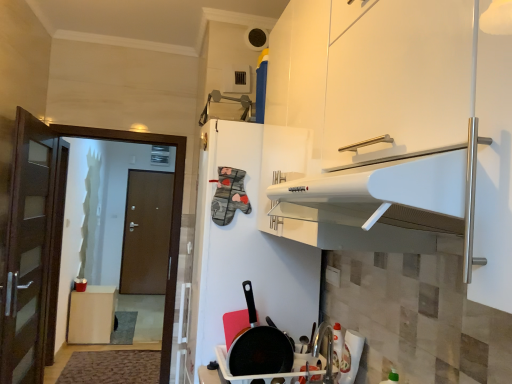
Question: Does brown wooden door at left have a larger size compared to brown wood trash can at left?

Choices:
 (A) no
 (B) yes

Answer: (B)

Question: Are brown wooden door at left and brown wood trash can at left located far from each other?

Choices:
 (A) no
 (B) yes

Answer: (B)

Question: Can you confirm if brown wooden door at left is thinner than brown wood trash can at left?

Choices:
 (A) no
 (B) yes

Answer: (B)

Question: Does brown wooden door at left contain brown wood trash can at left?

Choices:
 (A) no
 (B) yes

Answer: (A)

Question: From a real-world perspective, is brown wooden door at left positioned under brown wood trash can at left based on gravity?

Choices:
 (A) yes
 (B) no

Answer: (B)

Question: From a real-world perspective, is white matte refrigerator at center physically located above or below brown wood trash can at left?

Choices:
 (A) above
 (B) below

Answer: (A)

Question: Is white matte refrigerator at center bigger or smaller than brown wood trash can at left?

Choices:
 (A) small
 (B) big

Answer: (B)

Question: Is point (189, 367) closer or farther from the camera than point (106, 327)?

Choices:
 (A) closer
 (B) farther

Answer: (A)

Question: In the image, is white matte refrigerator at center positioned in front of or behind brown wood trash can at left?

Choices:
 (A) front
 (B) behind

Answer: (A)

Question: In the image, is brown matte door at left on the left side or the right side of brown wood trash can at left?

Choices:
 (A) right
 (B) left

Answer: (B)

Question: From the image's perspective, relative to brown wood trash can at left, is brown matte door at left above or below?

Choices:
 (A) above
 (B) below

Answer: (A)

Question: Is brown matte door at left wider or thinner than brown wood trash can at left?

Choices:
 (A) wide
 (B) thin

Answer: (B)

Question: Looking at the image, does brown matte door at left seem bigger or smaller compared to brown wood trash can at left?

Choices:
 (A) small
 (B) big

Answer: (B)

Question: Is white matte refrigerator at center taller or shorter than brown matte door at left?

Choices:
 (A) short
 (B) tall

Answer: (A)

Question: In the image, is white matte refrigerator at center on the left side or the right side of brown matte door at left?

Choices:
 (A) left
 (B) right

Answer: (B)